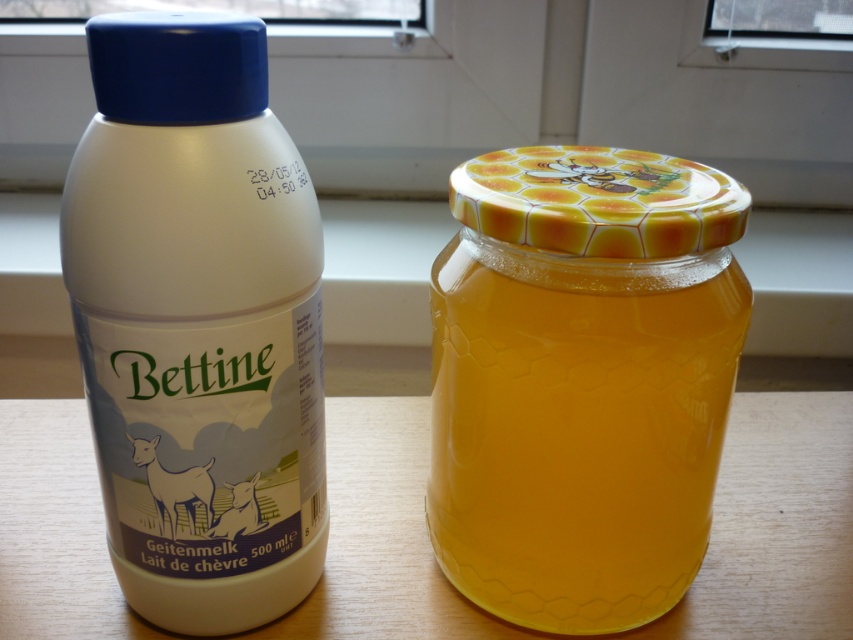
You are arranging items on a wooden table and want to place a white matte plastic bottle in front of it. Is the current position of the white matte plastic bottle at center in front of the wooden table at center suitable for your arrangement?

The white matte plastic bottle at center is already positioned in front of the wooden table at center, so the current placement meets your requirement.

Consider the image. You are organizing items on a wooden table and have a white matte plastic bottle. Considering their sizes, which object is taller between the white matte plastic bottle at center and the wooden table at center?

The white matte plastic bottle at center is taller than the wooden table at center according to the description.